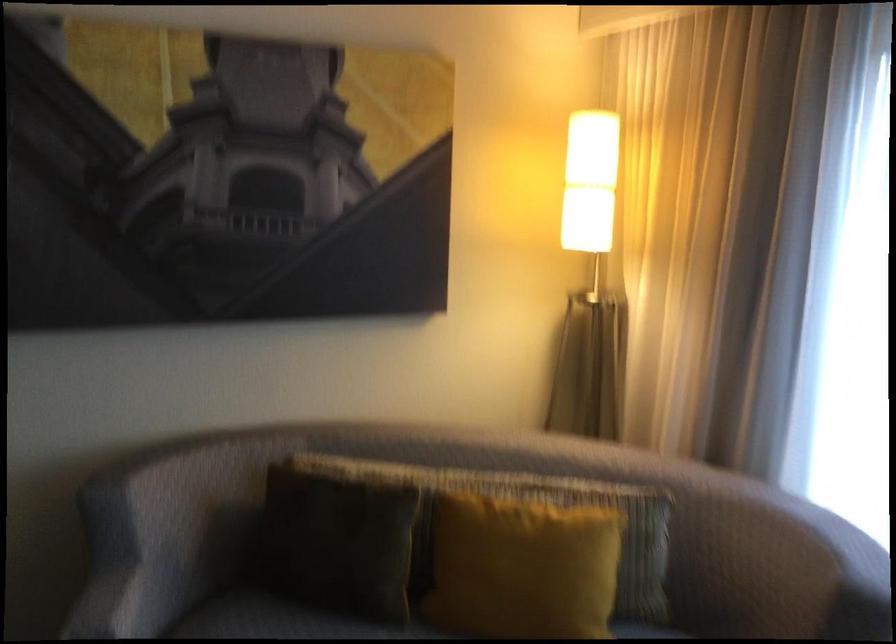
Find where to grabb the dark pillow. Please return your answer as a coordinate pair (x, y).

(339, 542)